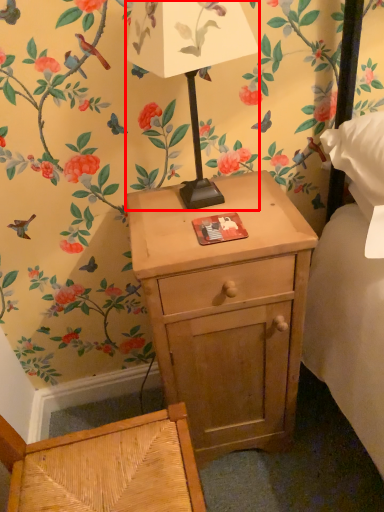
Question: From the image's perspective, what is the correct spatial relationship of table lamp (annotated by the red box) in relation to nightstand?

Choices:
 (A) above
 (B) below

Answer: (A)